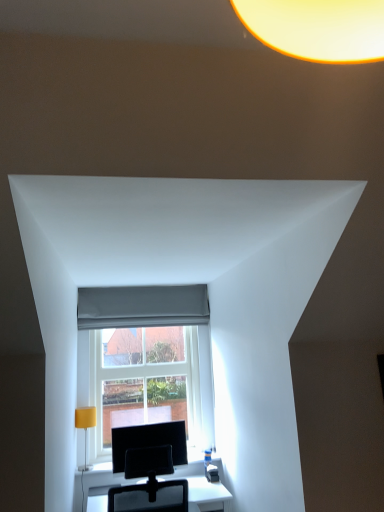
Locate an element on the screen. This screenshot has width=384, height=512. clear glass window at center is located at coordinates click(146, 360).

Describe the element at coordinates (146, 360) in the screenshot. I see `clear glass window at center` at that location.

What is the approximate width of black glossy monitor at center?

black glossy monitor at center is 2.28 inches in width.

Image resolution: width=384 pixels, height=512 pixels. Describe the element at coordinates (203, 488) in the screenshot. I see `white glossy table at center` at that location.

Image resolution: width=384 pixels, height=512 pixels. Identify the location of white glossy table at center. (203, 488).

What are the coordinates of `gray fabric curtain at center` in the screenshot? It's located at (142, 306).

Where is `yellow fabric lampshade at left`? The image size is (384, 512). yellow fabric lampshade at left is located at coordinates (85, 423).

From the image's perspective, which one is positioned higher, yellow fabric lampshade at left or white glossy table at center?

From the image's view, yellow fabric lampshade at left is above.

Considering the sizes of objects yellow fabric lampshade at left and white glossy table at center in the image provided, who is thinner, yellow fabric lampshade at left or white glossy table at center?

Thinner between the two is yellow fabric lampshade at left.

From a real-world perspective, is yellow fabric lampshade at left over white glossy table at center?

Yes, from a real-world perspective, yellow fabric lampshade at left is above white glossy table at center.

Considering the sizes of objects yellow fabric lampshade at left and white glossy table at center in the image provided, who is taller, yellow fabric lampshade at left or white glossy table at center?

With more height is yellow fabric lampshade at left.

Which object is further away from the camera taking this photo, yellow fabric lampshade at left or gray fabric curtain at center?

Positioned behind is gray fabric curtain at center.

Based on the photo, is yellow fabric lampshade at left located outside gray fabric curtain at center?

Yes, yellow fabric lampshade at left is outside of gray fabric curtain at center.

Considering the sizes of objects yellow fabric lampshade at left and gray fabric curtain at center in the image provided, who is taller, yellow fabric lampshade at left or gray fabric curtain at center?

yellow fabric lampshade at left.

Considering the points (82, 365) and (174, 428), which point is behind, point (82, 365) or point (174, 428)?

The point (82, 365) is behind.

From the image's perspective, is clear glass window at center positioned above or below black glossy monitor at center?

clear glass window at center is above black glossy monitor at center.

Is there a large distance between clear glass window at center and black glossy monitor at center?

That's not correct — clear glass window at center is a little close to black glossy monitor at center.

Consider the image. How many degrees apart are the facing directions of clear glass window at center and black glossy monitor at center?

The angle between the facing direction of clear glass window at center and the facing direction of black glossy monitor at center is 2.1 degrees.

Based on their positions, is clear glass window at center located to the left or right of gray fabric curtain at center?

clear glass window at center is positioned on gray fabric curtain at center's right side.

Is clear glass window at center positioned in front of gray fabric curtain at center?

Yes.

Is clear glass window at center thinner than gray fabric curtain at center?

Incorrect, the width of clear glass window at center is not less than that of gray fabric curtain at center.

Which of these two, yellow fabric lampshade at left or black glossy monitor at center, stands taller?

With more height is black glossy monitor at center.

Can black glossy monitor at center be found inside yellow fabric lampshade at left?

No, black glossy monitor at center is located outside of yellow fabric lampshade at left.

Is yellow fabric lampshade at left turned away from black glossy monitor at center?

No.

Are yellow fabric lampshade at left and black glossy monitor at center beside each other?

No, yellow fabric lampshade at left is not making contact with black glossy monitor at center.

Is yellow fabric lampshade at left to the left of clear glass window at center from the viewer's perspective?

Yes.

Could you tell me if yellow fabric lampshade at left is facing clear glass window at center?

No, yellow fabric lampshade at left is not oriented towards clear glass window at center.

Consider the image. From a real-world perspective, is yellow fabric lampshade at left over clear glass window at center?

No.

From the picture: Measure the distance between gray fabric curtain at center and white glossy table at center.

1.24 meters.

Is gray fabric curtain at center aimed at white glossy table at center?

No.

Considering the sizes of objects gray fabric curtain at center and white glossy table at center in the image provided, who is bigger, gray fabric curtain at center or white glossy table at center?

white glossy table at center.

Where is `table that appears below the yellow fabric lampshade at left (from the image's perspective)`? table that appears below the yellow fabric lampshade at left (from the image's perspective) is located at coordinates (203, 488).

Find the location of `curtain that is above the yellow fabric lampshade at left (from a real-world perspective)`. curtain that is above the yellow fabric lampshade at left (from a real-world perspective) is located at coordinates (142, 306).

When comparing their distances from yellow fabric lampshade at left, does black glossy monitor at center or clear glass window at center seem further?

Based on the image, clear glass window at center appears to be further to yellow fabric lampshade at left.

When comparing their distances from gray fabric curtain at center, does yellow fabric lampshade at left or black glossy monitor at center seem closer?

yellow fabric lampshade at left lies closer to gray fabric curtain at center than the other object.

Which object lies nearer to the anchor point gray fabric curtain at center, yellow fabric lampshade at left or clear glass window at center?

clear glass window at center is closer to gray fabric curtain at center.

Based on their spatial positions, is yellow fabric lampshade at left or white glossy table at center further from gray fabric curtain at center?

white glossy table at center.

From the image, which object appears to be farther from yellow fabric lampshade at left, clear glass window at center or white glossy table at center?

The object further to yellow fabric lampshade at left is white glossy table at center.

From the image, which object appears to be nearer to clear glass window at center, yellow fabric lampshade at left or black glossy monitor at center?

black glossy monitor at center lies closer to clear glass window at center than the other object.

Looking at the image, which one is located further to white glossy table at center, yellow fabric lampshade at left or clear glass window at center?

Based on the image, clear glass window at center appears to be further to white glossy table at center.

Considering their positions, is yellow fabric lampshade at left positioned further to black glossy monitor at center than gray fabric curtain at center?

Among the two, gray fabric curtain at center is located further to black glossy monitor at center.

Where is `window located between yellow fabric lampshade at left and black glossy monitor at center in the left-right direction`? Image resolution: width=384 pixels, height=512 pixels. window located between yellow fabric lampshade at left and black glossy monitor at center in the left-right direction is located at coordinates (146, 360).

This screenshot has width=384, height=512. Identify the location of computer monitor between white glossy table at center and yellow fabric lampshade at left along the z-axis. (149, 441).

Identify the location of table lamp between white glossy table at center and clear glass window at center in the front-back direction. (85, 423).

Where is `window between gray fabric curtain at center and white glossy table at center vertically`? window between gray fabric curtain at center and white glossy table at center vertically is located at coordinates (146, 360).